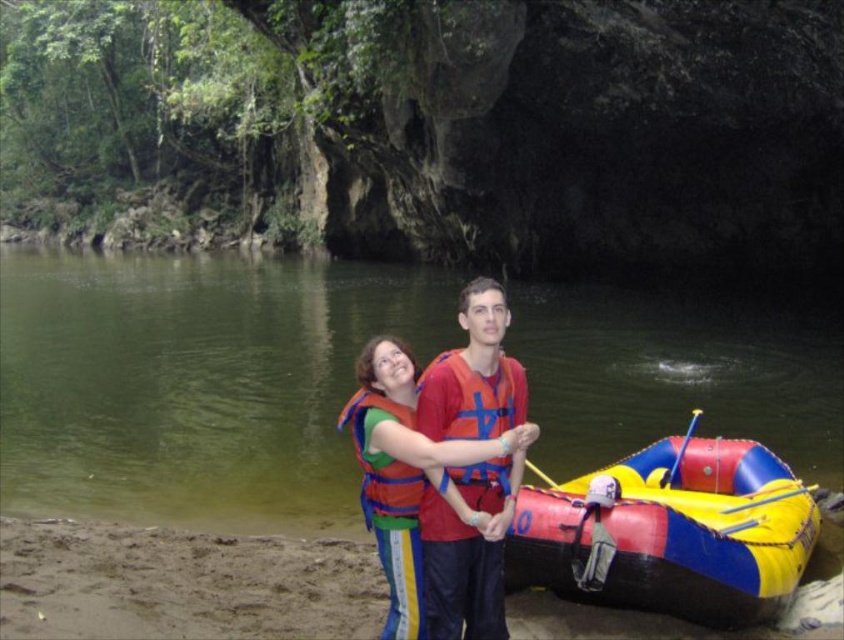
Can you confirm if green rubber raft at center is taller than orange life jacket at center?

Indeed, green rubber raft at center has a greater height compared to orange life jacket at center.

Does green rubber raft at center have a greater width compared to orange life jacket at center?

Correct, the width of green rubber raft at center exceeds that of orange life jacket at center.

Which is behind, point (666, 305) or point (425, 387)?

The point (666, 305) is more distant.

Where is `green rubber raft at center`? The width and height of the screenshot is (844, 640). green rubber raft at center is located at coordinates point(193,380).

Between point (498, 557) and point (482, 380), which one is positioned in front?

Point (482, 380) is in front.

Does matte orange life vest at center have a greater height compared to orange life jacket at center?

No.

Does point (455, 554) come farther from viewer compared to point (434, 410)?

That is False.

The height and width of the screenshot is (640, 844). Identify the location of matte orange life vest at center. (468, 552).

Who is more forward, (x=237, y=477) or (x=518, y=577)?

Point (x=518, y=577)

Does point (528, 364) come farther from viewer compared to point (717, 467)?

That is True.

Where is `green rubber raft at center`? Image resolution: width=844 pixels, height=640 pixels. green rubber raft at center is located at coordinates (193, 380).